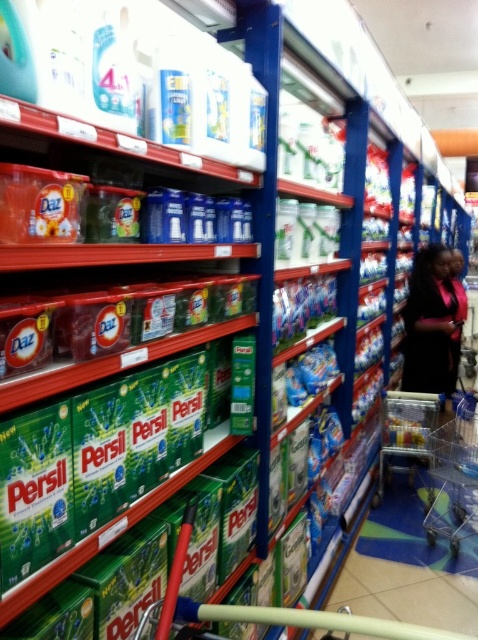
You are standing in the supermarket aisle and see the dark blue fabric dress at lower right and the metallic silver shopping cart at lower right. Which one is positioned more to the right side of the aisle?

The dark blue fabric dress at lower right is positioned to the right of the metallic silver shopping cart at lower right, so the dress is more to the right side of the aisle.

You are standing in the supermarket aisle and want to reach both the point at coordinates (434,444) and the point at coordinates (403,417). Which point should you move towards first to reach the closer one?

You should move towards point (434,444) first because it is closer to you than point (403,417).

You are a customer in the supermarket and see the dark blue fabric dress at lower right and the metallic silver shopping cart at lower right. Which object is larger in size?

The dark blue fabric dress at lower right is bigger than the metallic silver shopping cart at lower right.